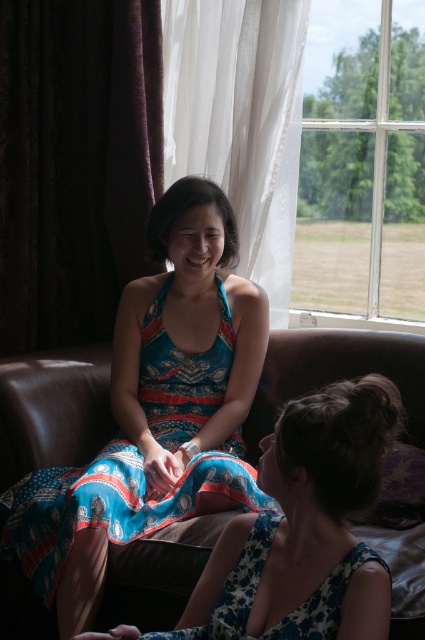
You are a photographer setting up a shoot in this living room. You need to place a large tripod between the brown leather couch at center and the floral fabric dress at lower center. Can you fit it there?

The brown leather couch at center is positioned over the floral fabric dress at lower center, meaning there is no space between them. Therefore, you cannot fit a large tripod between them.

From the picture: You are a delivery person holding a package that needs to be placed on a shelf between the clear glass window at upper right and the blue printed dress at center. The shelf is 3 feet wide. Can the package fit between them?

The distance between the clear glass window at upper right and the blue printed dress at center is 3.62 feet, which is wider than the 3 feet shelf. Therefore, the package can fit on the shelf between them.

What is located at the coordinate point (76,163) in the image?

The dark velvet curtain at left is located at the coordinate point (76,163).